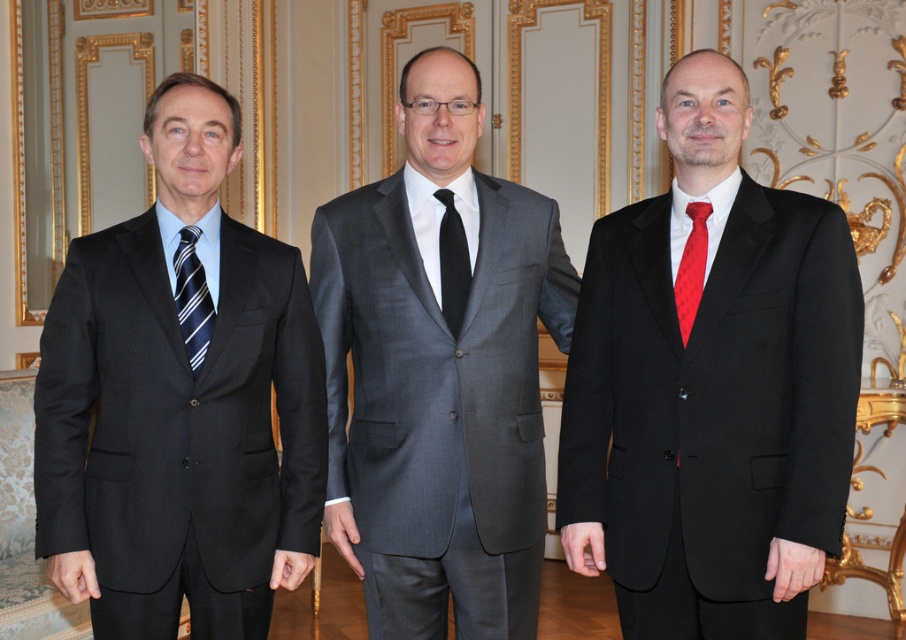
You are a photographer adjusting the lighting for a portrait. You notice the matte black suit at left and the striped fabric tie at left in the frame. How far apart are these two items in inches?

The matte black suit at left is 8.93 inches from the striped fabric tie at left, so the distance between them is exactly 8.93 inches.

You are a photographer adjusting the camera settings for a group portrait. The subjects are three men in suits. You need to focus on the matte black suit at left. Where should you position the focus point on the camera grid? The grid has coordinates from 0 to 1 on both axes.

The focus point should be set at coordinates 0.631 on the x axis and 0.199 on the y axis to accurately target the matte black suit at left.